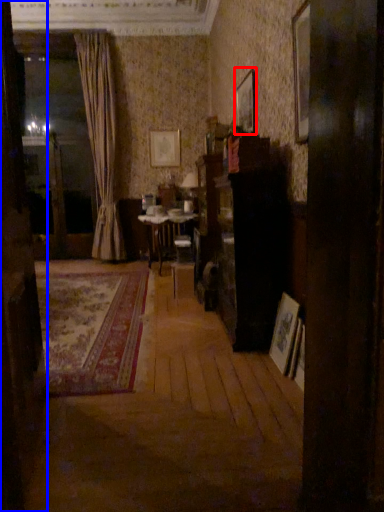
Question: Among these objects, which one is nearest to the camera, picture frame (highlighted by a red box) or door (highlighted by a blue box)?

Choices:
 (A) picture frame
 (B) door

Answer: (B)